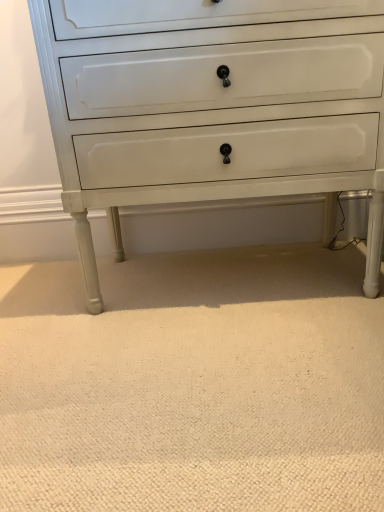
The height and width of the screenshot is (512, 384). I want to click on white glossy chest of drawers at center, so click(212, 106).

What do you see at coordinates (212, 106) in the screenshot?
I see `white glossy chest of drawers at center` at bounding box center [212, 106].

Find the location of a particular element. This screenshot has height=512, width=384. white glossy chest of drawers at center is located at coordinates (212, 106).